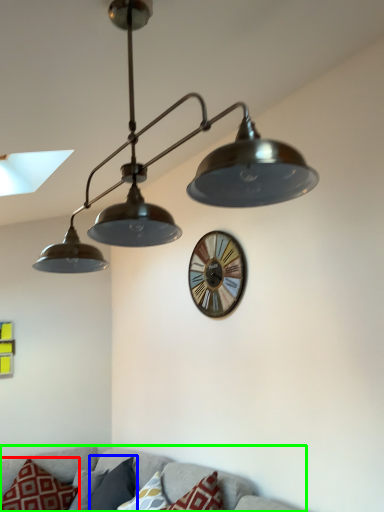
Question: Which object is positioned closest to pillow (highlighted by a red box)? Select from pillow (highlighted by a blue box) and couch (highlighted by a green box).

Choices:
 (A) pillow
 (B) couch

Answer: (A)